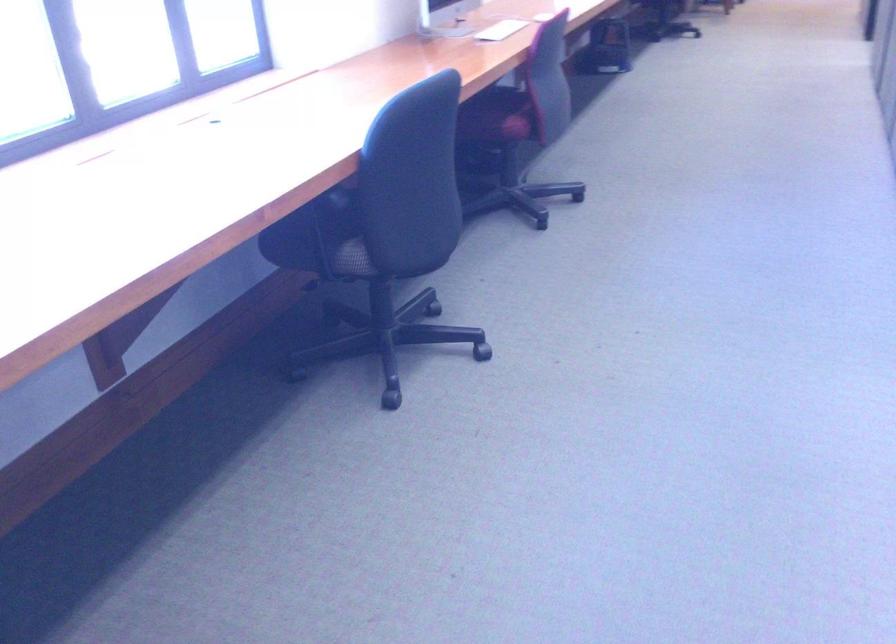
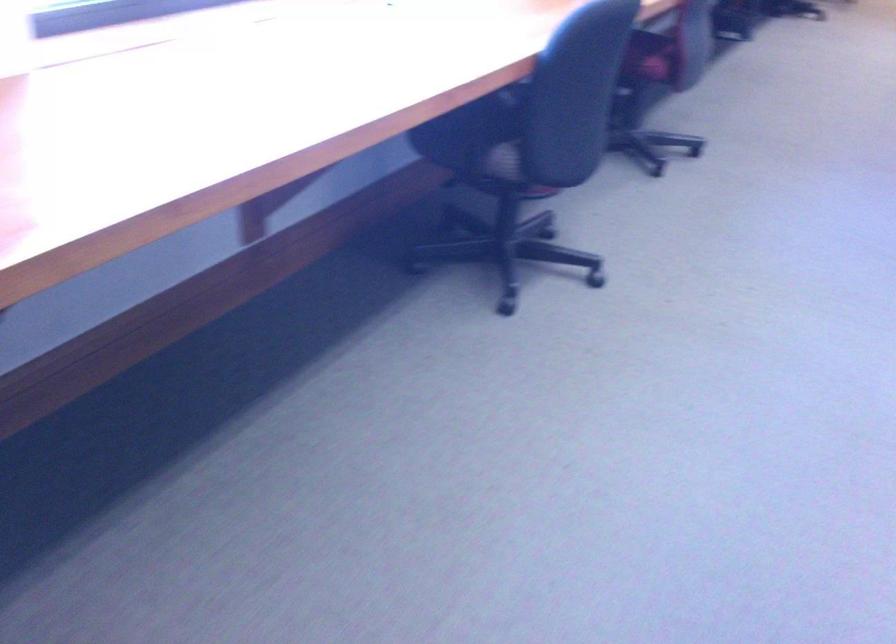
Question: The images are taken continuously from a first-person perspective. In which direction is your viewpoint rotating?

Choices:
 (A) Left
 (B) Right
 (C) Up
 (D) Down

Answer: (D)